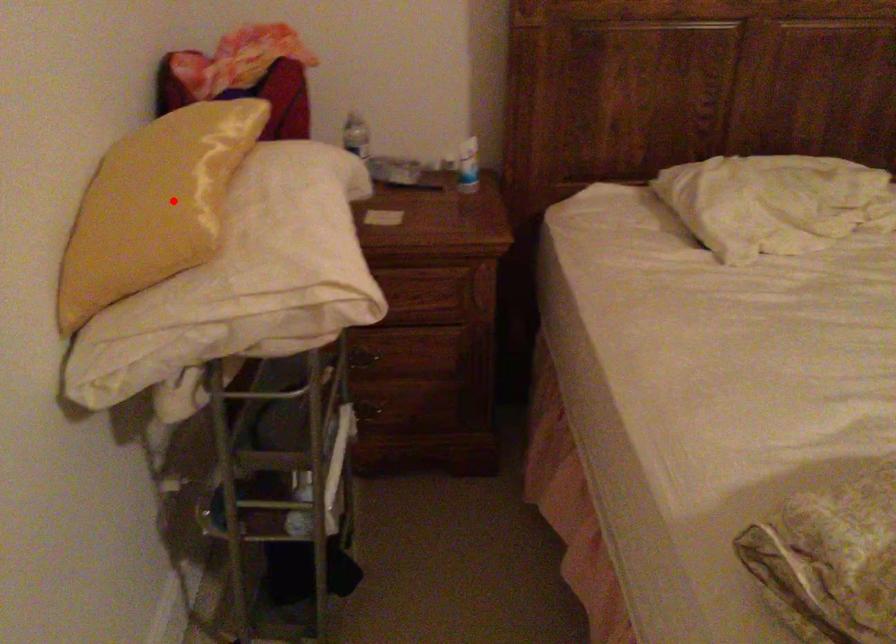
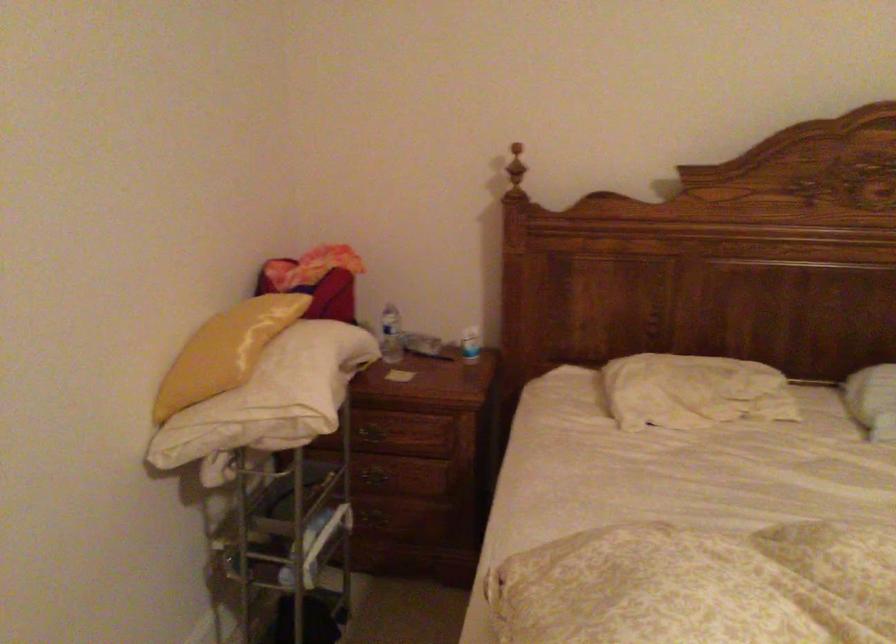
Question: I am providing you with two images of the same scene from different viewpoints. A red point is shown in image1. For the corresponding object point in image2, is it positioned nearer or farther from the camera?

Choices:
 (A) Nearer
 (B) Farther

Answer: (B)